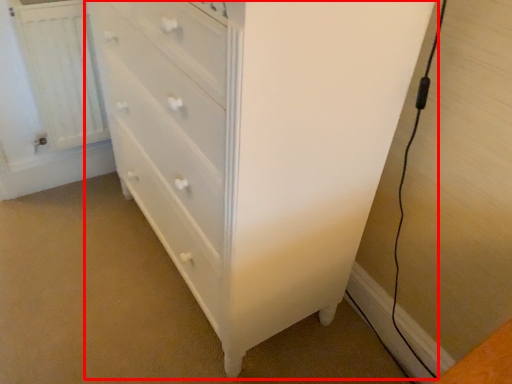
Question: Observing the image, what is the correct spatial positioning of chest of drawers (annotated by the red box) in reference to radiator?

Choices:
 (A) right
 (B) left

Answer: (A)